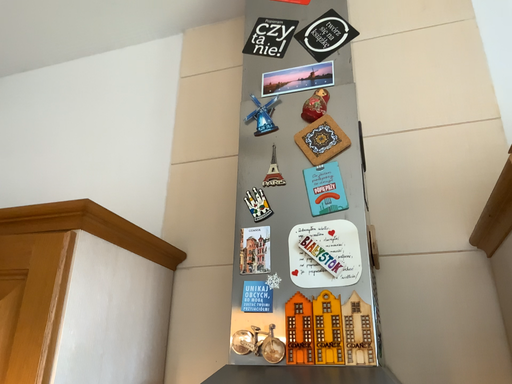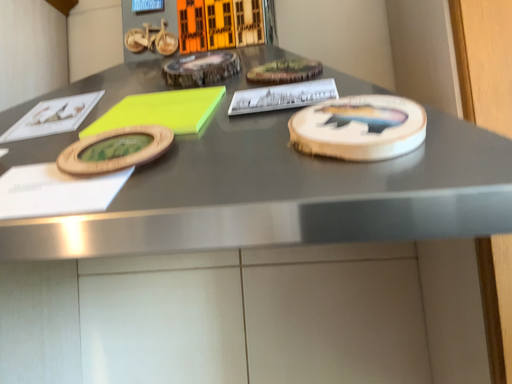
Question: Which way did the camera rotate in the video?

Choices:
 (A) rotated right
 (B) rotated left

Answer: (A)